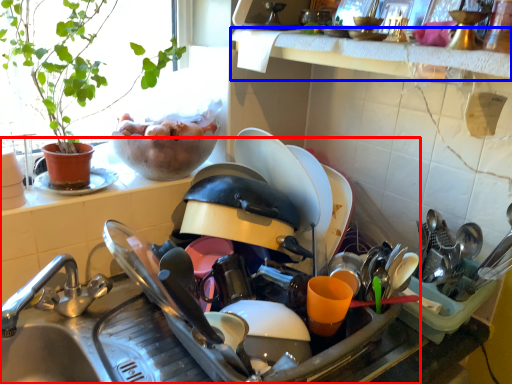
Question: Which object is further to the camera taking this photo, sink (highlighted by a red box) or window sill (highlighted by a blue box)?

Choices:
 (A) sink
 (B) window sill

Answer: (B)